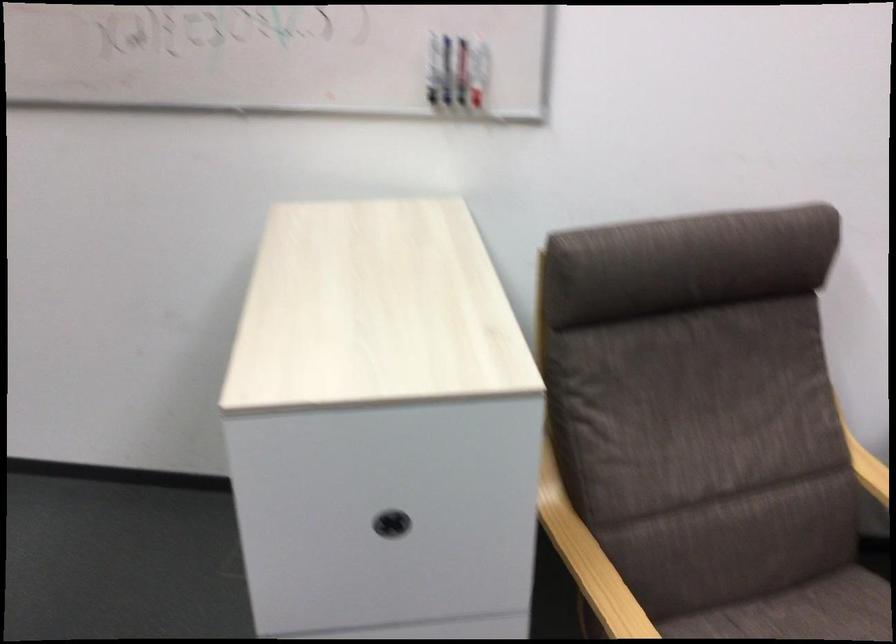
This screenshot has width=896, height=644. What do you see at coordinates (391, 524) in the screenshot?
I see `the black drawer handle` at bounding box center [391, 524].